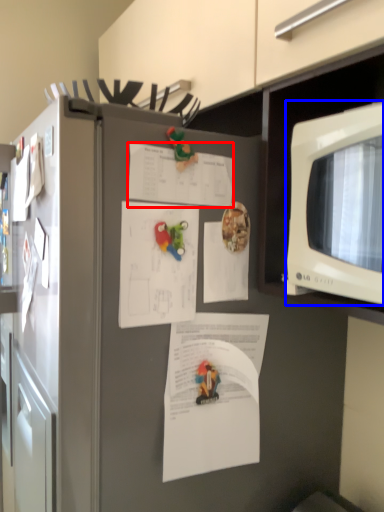
Question: Which of the following is the closest to the observer, document (highlighted by a red box) or microwave oven (highlighted by a blue box)?

Choices:
 (A) document
 (B) microwave oven

Answer: (B)